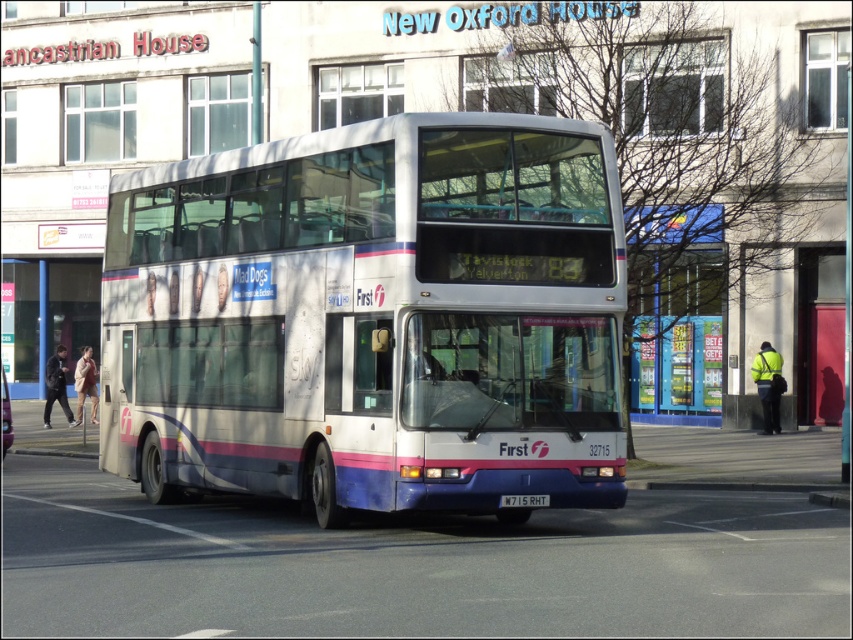
Question: Can you confirm if white metallic bus at center is positioned to the right of white plastic license plate at center?

Choices:
 (A) yes
 (B) no

Answer: (B)

Question: Which point is farther from the camera taking this photo?

Choices:
 (A) (527, 502)
 (B) (514, 193)

Answer: (B)

Question: Is white metallic bus at center below white plastic license plate at center?

Choices:
 (A) no
 (B) yes

Answer: (A)

Question: Is white metallic bus at center closer to camera compared to white plastic license plate at center?

Choices:
 (A) yes
 (B) no

Answer: (B)